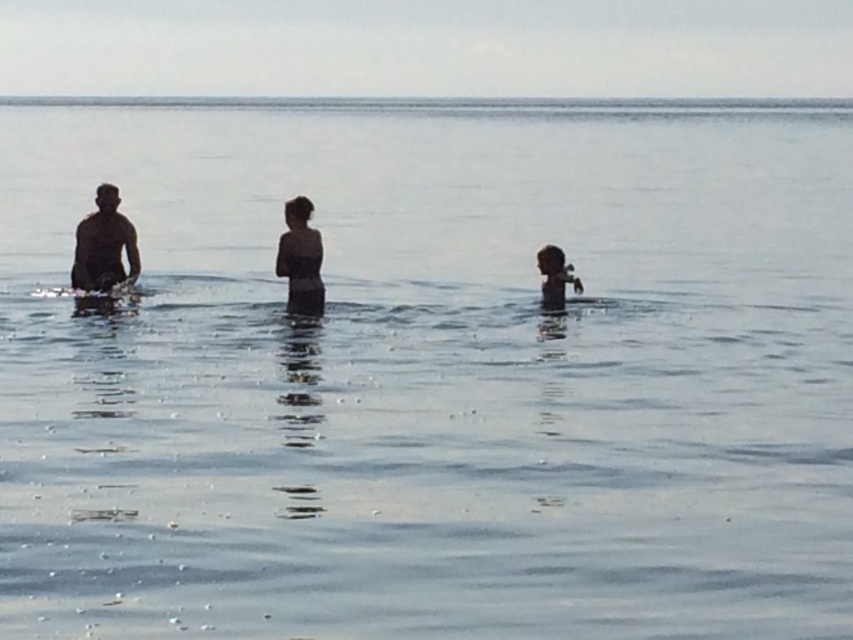
You are a lifeguard observing the beach scene. You notice three people in the water. The dark skin human at left is one of them. Based on their position, can you determine if they are closer to the shore or further out in the water?

The dark skin human at left is located at point (103, 244), which places them closer to the shore compared to the other individuals in the scene.

You are a lifeguard on duty and need to locate the dark skin human at left in the water. According to the coordinates provided, where exactly should you look?

You should look at point (x=103, y=244) to find the dark skin human at left.